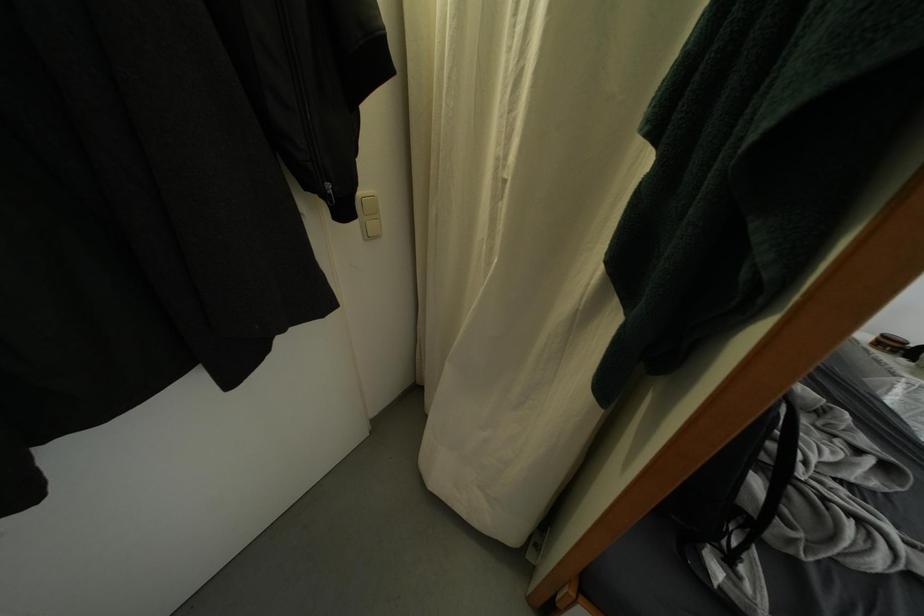
Where is `small brown bottle`? small brown bottle is located at coordinates (889, 342).